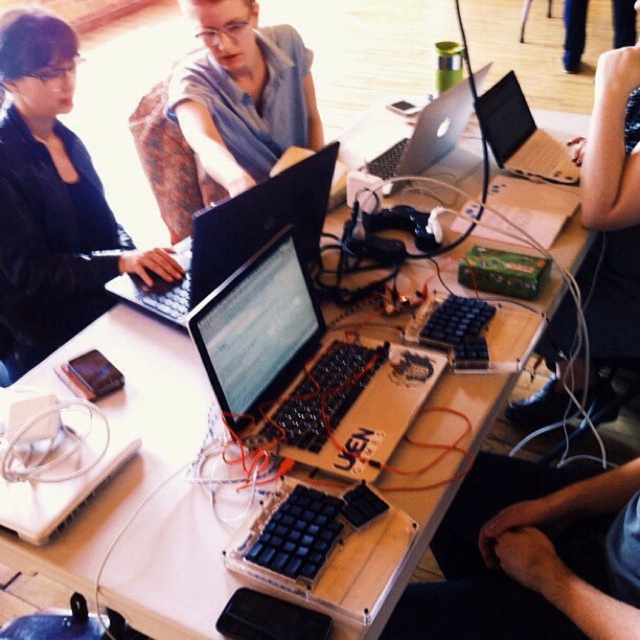
You are standing at the origin point in the image. Which object is located at point (51, 202)?

The matte black laptop at left is located at point (51, 202).

You are organizing a tech workshop and need to place the black matte keyboard at lower right and the black fabric sleeve at upper right on a shelf. If the shelf has a height limit of 10 cm, can both items fit without exceeding the height limit?

The black matte keyboard at lower right is not as tall as the black fabric sleeve at upper right. Since the height limit is 10 cm, both items can fit on the shelf as long as their combined height does not exceed the limit. However, without knowing the exact heights of each item, it is impossible to determine if they will fit individually or together.

In the scene shown: You are organizing a tech workshop and need to place both the matte black laptop at left and the silver metallic laptop at upper right on a shelf. The shelf has a width of 1 meter. Can both laptops fit side by side without overlapping?

The matte black laptop at left might be wider than the silver metallic laptop at upper right, so it is uncertain if both can fit side by side on a 1 meter shelf. Measure their combined width to confirm.